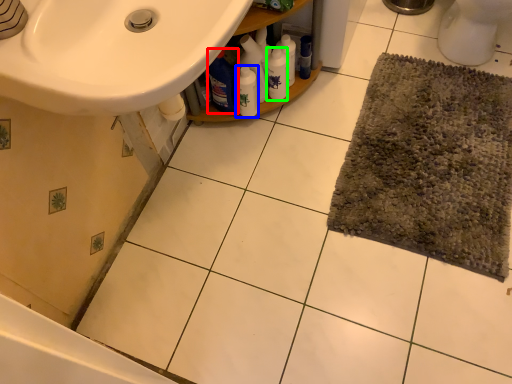
Question: Estimate the real-world distances between objects in this image. Which object is farther from cleaning product (highlighted by a red box), bottle (highlighted by a blue box) or cleaning product (highlighted by a green box)?

Choices:
 (A) bottle
 (B) cleaning product

Answer: (B)